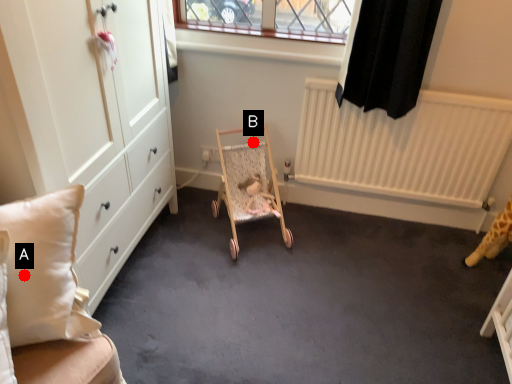
Question: Two points are circled on the image, labeled by A and B beside each circle. Which point is further to the camera?

Choices:
 (A) A is further
 (B) B is further

Answer: (B)